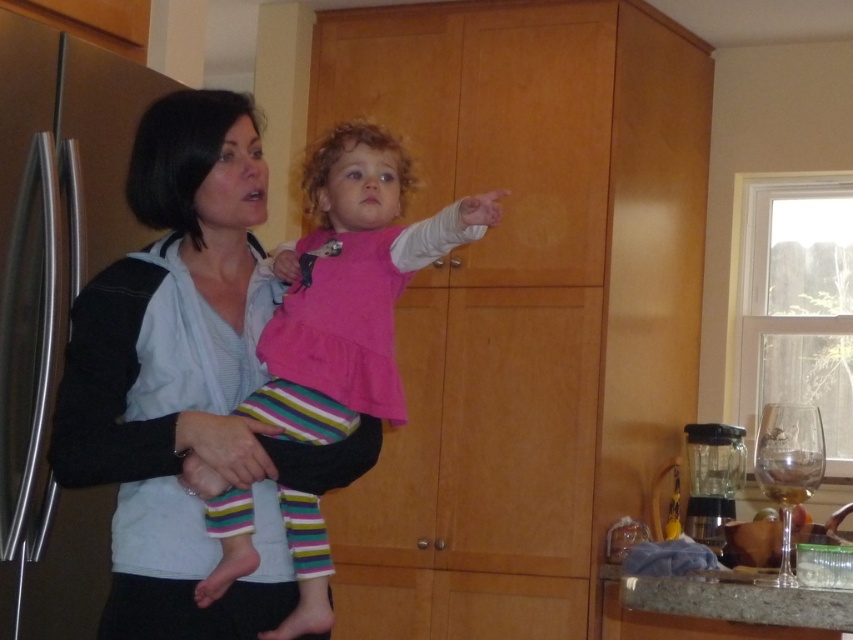
Can you confirm if pink fabric baby at center is bigger than granite countertop at lower right?

Yes, pink fabric baby at center is bigger than granite countertop at lower right.

Is point (436, 230) positioned behind point (750, 605)?

No, (436, 230) is in front of (750, 605).

Is point (219, 573) closer to viewer compared to point (833, 595)?

Yes.

In order to click on pink fabric baby at center in this screenshot , I will do (x=352, y=285).

Can you confirm if matte black sweater at center is thinner than granite countertop at lower right?

Incorrect, matte black sweater at center's width is not less than granite countertop at lower right's.

Where is `matte black sweater at center`? matte black sweater at center is located at coordinates (181, 376).

The width and height of the screenshot is (853, 640). What do you see at coordinates (181, 376) in the screenshot?
I see `matte black sweater at center` at bounding box center [181, 376].

Does point (154, 540) come closer to viewer compared to point (361, 403)?

Yes, point (154, 540) is in front of point (361, 403).

The height and width of the screenshot is (640, 853). What do you see at coordinates (181, 376) in the screenshot?
I see `matte black sweater at center` at bounding box center [181, 376].

Locate an element on the screen. Image resolution: width=853 pixels, height=640 pixels. matte black sweater at center is located at coordinates (181, 376).